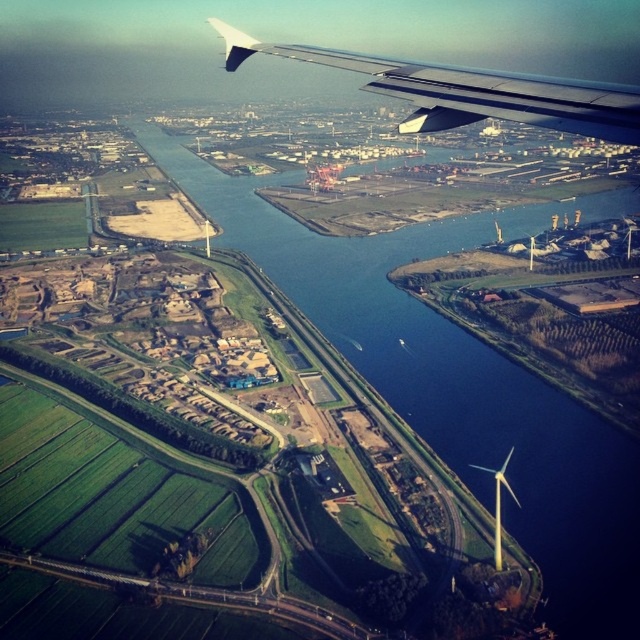
Consider the image. Which is more to the right, blue water at lower left or metallic gray wing at upper right?

blue water at lower left is more to the right.

Which is below, blue water at lower left or metallic gray wing at upper right?

blue water at lower left is below.

Does point (225, 218) come closer to viewer compared to point (429, 120)?

No, it is not.

Where is `blue water at lower left`? This screenshot has height=640, width=640. blue water at lower left is located at coordinates (458, 381).